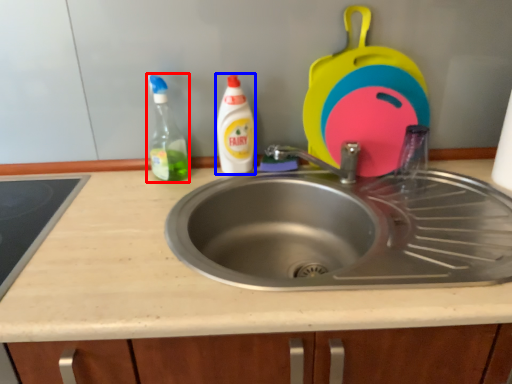
Question: Which object is closer to the camera taking this photo, cleaning product (highlighted by a red box) or cleaning product (highlighted by a blue box)?

Choices:
 (A) cleaning product
 (B) cleaning product

Answer: (A)